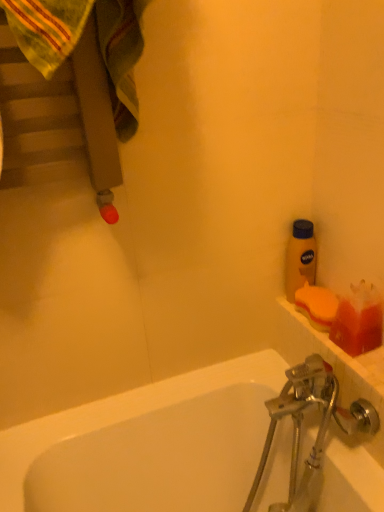
Question: In the image, is orange sponge at right on the left side or the right side of yellow matte bottle at upper right?

Choices:
 (A) left
 (B) right

Answer: (B)

Question: Based on their sizes in the image, would you say orange sponge at right is bigger or smaller than yellow matte bottle at upper right?

Choices:
 (A) small
 (B) big

Answer: (A)

Question: Considering the real-world distances, which object is farthest from the yellow matte bottle at upper right?

Choices:
 (A) translucent orange soap at right
 (B) orange sponge at right

Answer: (A)

Question: Estimate the real-world distances between objects in this image. Which object is closer to the yellow matte bottle at upper right?

Choices:
 (A) translucent orange soap at right
 (B) orange sponge at right

Answer: (B)